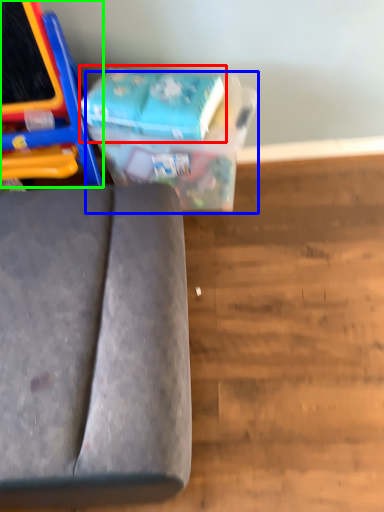
Question: Considering the real-world distances, which object is closest to paperback book (highlighted by a red box)? cardboard box (highlighted by a blue box) or furniture (highlighted by a green box).

Choices:
 (A) cardboard box
 (B) furniture

Answer: (A)